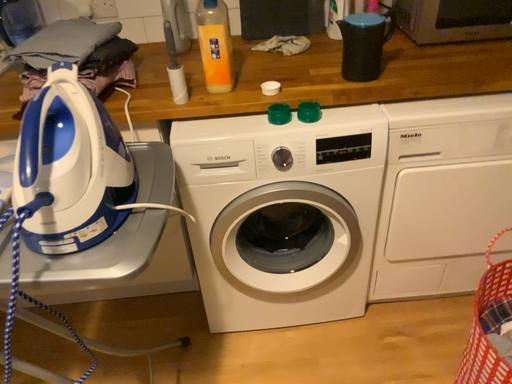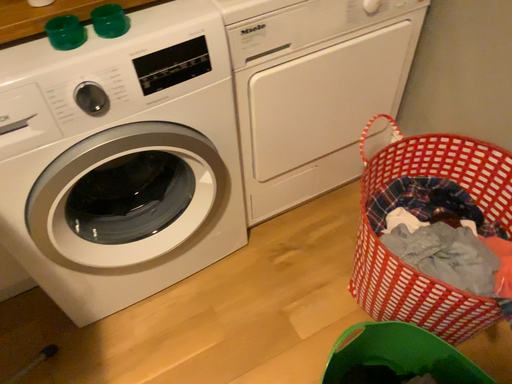
Question: How did the camera likely rotate when shooting the video?

Choices:
 (A) rotated downward
 (B) rotated upward

Answer: (A)